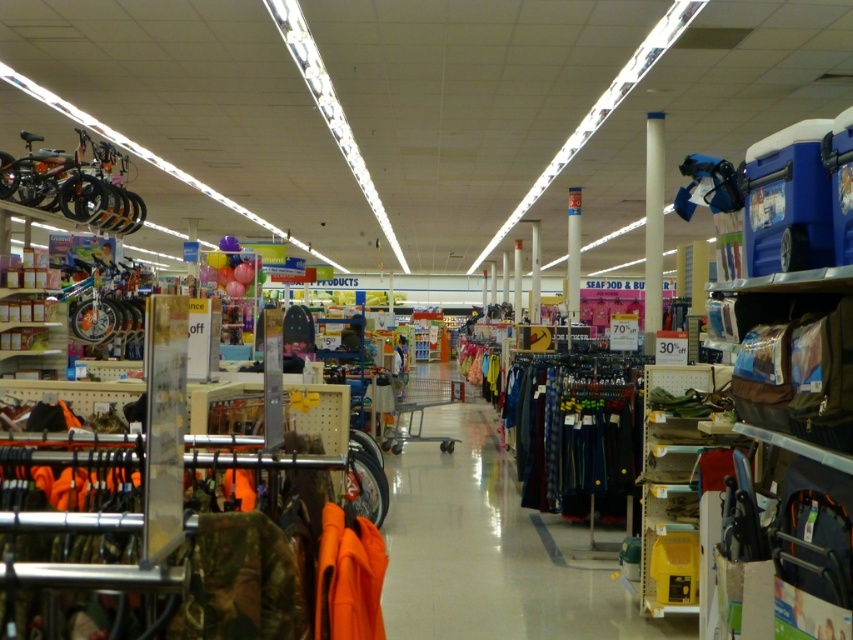
Between yellow plastic bin at lower right and white matte pillar at center, which one is positioned lower?

yellow plastic bin at lower right is lower down.

Based on the photo, who is higher up, yellow plastic bin at lower right or white matte pillar at center?

white matte pillar at center is above.

I want to click on yellow plastic bin at lower right, so click(672, 477).